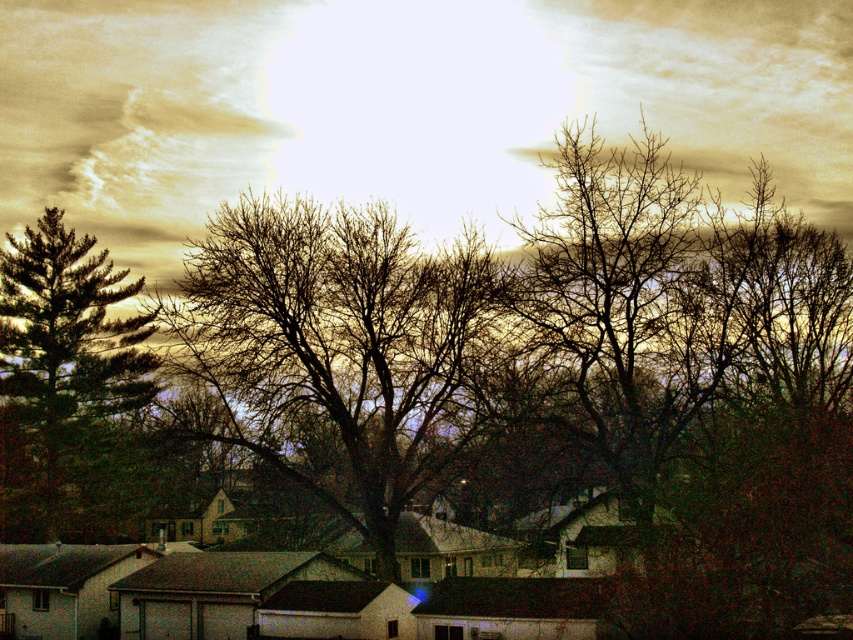
You are an artist trying to paint the suburban scene. You want to ensure the white cotton cloud at upper center and the bare branches at center are proportionally accurate. Which object should you draw wider?

The white cotton cloud at upper center should be drawn wider since its width is larger than the bare branches at center.

You are standing in the suburban scene and notice two trees. The first is the bare branches at center, and the second is the green matte tree at left. Which tree is positioned to the right of the other?

The bare branches at center are to the right of the green matte tree at left.